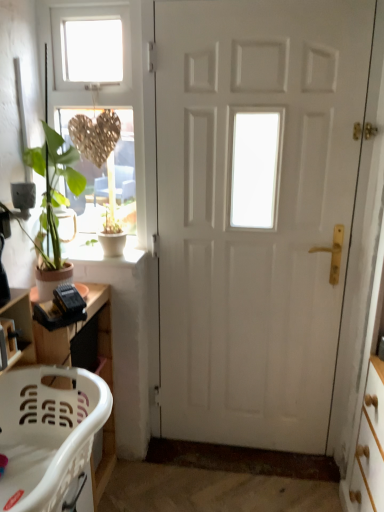
What is the approximate width of white concrete window sill at lower left?

The width of white concrete window sill at lower left is 7.38 inches.

The image size is (384, 512). Describe the element at coordinates (255, 212) in the screenshot. I see `white matte door at center` at that location.

Locate an element on the screen. This screenshot has height=512, width=384. white plastic laundry basket at lower left is located at coordinates (47, 433).

What is the approximate height of white matte pot at window?

It is 8.70 inches.

Describe the element at coordinates (114, 88) in the screenshot. I see `matte gold heart at upper left` at that location.

Measure the distance between matte gold heart at upper left and camera.

matte gold heart at upper left and camera are 1.63 meters apart from each other.

What are the coordinates of `white concrete window sill at lower left` in the screenshot? It's located at (101, 252).

From the image's perspective, between white matte pot at window and white concrete window sill at lower left, who is located below?

white concrete window sill at lower left, from the image's perspective.

Are white matte pot at window and white concrete window sill at lower left far apart?

No, white matte pot at window is not far from white concrete window sill at lower left.

From a real-world perspective, is white matte pot at window on top of white concrete window sill at lower left?

Yes, from a real-world perspective, white matte pot at window is above white concrete window sill at lower left.

From a real-world perspective, is white concrete window sill at lower left positioned over white matte pot at window based on gravity?

No, from a real-world perspective, white concrete window sill at lower left is not on top of white matte pot at window.

Is white concrete window sill at lower left facing towards white matte pot at window?

No.

Is point (95, 241) closer or farther from the camera than point (109, 219)?

Point (95, 241) is farther from the camera than point (109, 219).

From the picture: Is white plastic laundry basket at lower left bigger than white plastic laundry basket at lower left?

Indeed, white plastic laundry basket at lower left has a larger size compared to white plastic laundry basket at lower left.

Is point (109, 337) positioned before point (39, 448)?

No.

From a real-world perspective, which is physically above, white plastic laundry basket at lower left or white plastic laundry basket at lower left?

white plastic laundry basket at lower left, from a real-world perspective.

Is the depth of white plastic laundry basket at lower left greater than that of white matte door at center?

No, the depth of white plastic laundry basket at lower left is less than that of white matte door at center.

From the image's perspective, is white plastic laundry basket at lower left below white matte door at center?

Yes, from the image's perspective, white plastic laundry basket at lower left is below white matte door at center.

Which object is thinner, white plastic laundry basket at lower left or white matte door at center?

white matte door at center.

Choose the correct answer: Is white plastic laundry basket at lower left inside white matte door at center or outside it?

white plastic laundry basket at lower left lies outside white matte door at center.

Is white matte door at center taller than white plastic laundry basket at lower left?

Indeed, white matte door at center has a greater height compared to white plastic laundry basket at lower left.

Is white matte door at center bigger than white plastic laundry basket at lower left?

Yes, white matte door at center is bigger than white plastic laundry basket at lower left.

Is white matte door at center looking in the opposite direction of white plastic laundry basket at lower left?

white matte door at center does not have its back to white plastic laundry basket at lower left.

Is white matte door at center to the right of white plastic laundry basket at lower left from the viewer's perspective?

Yes, white matte door at center is to the right of white plastic laundry basket at lower left.

Is point (84, 237) behind point (14, 304)?

Yes, it is.

Can you confirm if white concrete window sill at lower left is shorter than wooden shelf at lower left?

Correct, white concrete window sill at lower left is not as tall as wooden shelf at lower left.

Which object is further away from the camera, white concrete window sill at lower left or wooden shelf at lower left?

white concrete window sill at lower left.

Between white plastic laundry basket at lower left and white plastic laundry basket at lower left, which one is positioned in front?

Positioned in front is white plastic laundry basket at lower left.

From the image's perspective, does white plastic laundry basket at lower left appear higher than white plastic laundry basket at lower left?

Indeed, from the image's perspective, white plastic laundry basket at lower left is shown above white plastic laundry basket at lower left.

Is white plastic laundry basket at lower left inside white plastic laundry basket at lower left?

That's incorrect, white plastic laundry basket at lower left is not inside white plastic laundry basket at lower left.

From the picture: In terms of height, does white plastic laundry basket at lower left look taller or shorter compared to white plastic laundry basket at lower left?

Considering their sizes, white plastic laundry basket at lower left has less height than white plastic laundry basket at lower left.

I want to click on window sill that appears below the white matte pot at window (from a real-world perspective), so click(101, 252).

Locate an element on the screen. The width and height of the screenshot is (384, 512). houseplant lying in front of the white concrete window sill at lower left is located at coordinates (112, 236).

From the image, which object appears to be nearer to white plastic laundry basket at lower left, white plastic laundry basket at lower left or matte gold heart at upper left?

white plastic laundry basket at lower left is positioned closer to the anchor white plastic laundry basket at lower left.

Based on their spatial positions, is white matte door at center or white plastic laundry basket at lower left further from white matte pot at window?

Based on the image, white matte door at center appears to be further to white matte pot at window.

Based on their spatial positions, is white matte pot at window or white plastic laundry basket at lower left closer to white matte door at center?

Among the two, white matte pot at window is located nearer to white matte door at center.

Which object lies further to the anchor point wooden shelf at lower left, white plastic laundry basket at lower left or white concrete window sill at lower left?

The object further to wooden shelf at lower left is white concrete window sill at lower left.

Which object lies nearer to the anchor point wooden shelf at lower left, white plastic laundry basket at lower left or matte gold heart at upper left?

white plastic laundry basket at lower left is positioned closer to the anchor wooden shelf at lower left.

From the image, which object appears to be nearer to white plastic laundry basket at lower left, white matte pot at window or white concrete window sill at lower left?

white concrete window sill at lower left lies closer to white plastic laundry basket at lower left than the other object.

Considering their positions, is white concrete window sill at lower left positioned further to matte gold heart at upper left than white plastic laundry basket at lower left?

The object further to matte gold heart at upper left is white plastic laundry basket at lower left.

Estimate the real-world distances between objects in this image. Which object is closer to white plastic laundry basket at lower left, white concrete window sill at lower left or white plastic laundry basket at lower left?

Among the two, white plastic laundry basket at lower left is located nearer to white plastic laundry basket at lower left.

I want to click on window located between white concrete window sill at lower left and white matte door at center in the left-right direction, so click(x=114, y=88).

The height and width of the screenshot is (512, 384). I want to click on houseplant between wooden shelf at lower left and white concrete window sill at lower left from front to back, so click(112, 236).

Identify the location of cabinetry between wooden shelf at lower left and white matte door at center in the horizontal direction. (81, 338).

Image resolution: width=384 pixels, height=512 pixels. I want to click on houseplant between matte gold heart at upper left and white plastic laundry basket at lower left vertically, so click(112, 236).